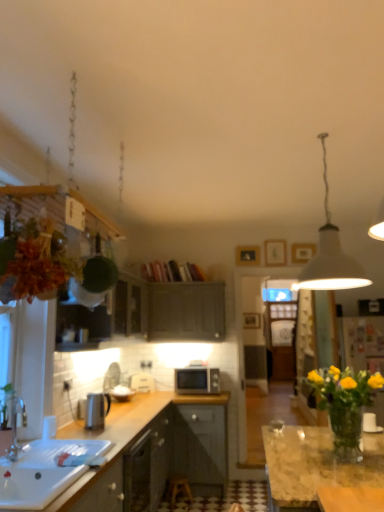
Image resolution: width=384 pixels, height=512 pixels. In order to click on free point below wooden stool at center (from a real-world perspective) in this screenshot , I will do `click(192, 498)`.